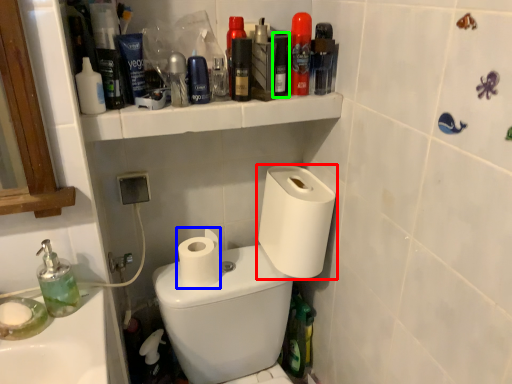
Question: Which object is the farthest from toilet paper (highlighted by a red box)? Choose among these: toilet paper (highlighted by a blue box) or mouthwash (highlighted by a green box).

Choices:
 (A) toilet paper
 (B) mouthwash

Answer: (B)